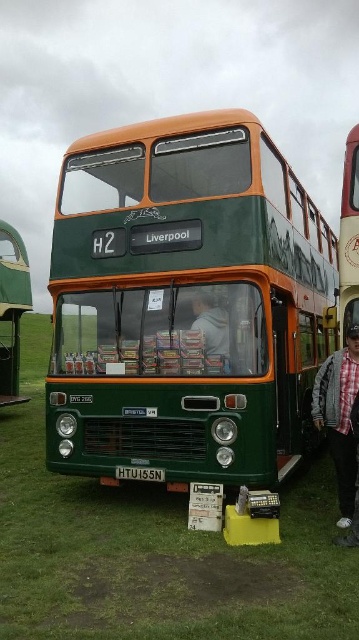
Question: Is green grass at center closer to camera compared to green fabric jacket at center?

Choices:
 (A) no
 (B) yes

Answer: (B)

Question: Estimate the real-world distances between objects in this image. Which object is farther from the green matte bus at left?

Choices:
 (A) green fabric jacket at center
 (B) plaid fabric shirt at lower right
 (C) green matte/decorative bus at center

Answer: (B)

Question: Does green matte/decorative bus at center appear on the left side of green grass at center?

Choices:
 (A) no
 (B) yes

Answer: (A)

Question: Which is farther from the black plastic license plate at center?

Choices:
 (A) green matte/decorative bus at center
 (B) green matte bus at center
 (C) green fabric jacket at center

Answer: (B)

Question: Is plaid fabric shirt at lower right further to camera compared to green fabric jacket at center?

Choices:
 (A) yes
 (B) no

Answer: (B)

Question: Considering the real-world distances, which object is farthest from the black plastic license plate at center?

Choices:
 (A) plaid fabric shirt at lower right
 (B) green matte/decorative bus at center

Answer: (B)